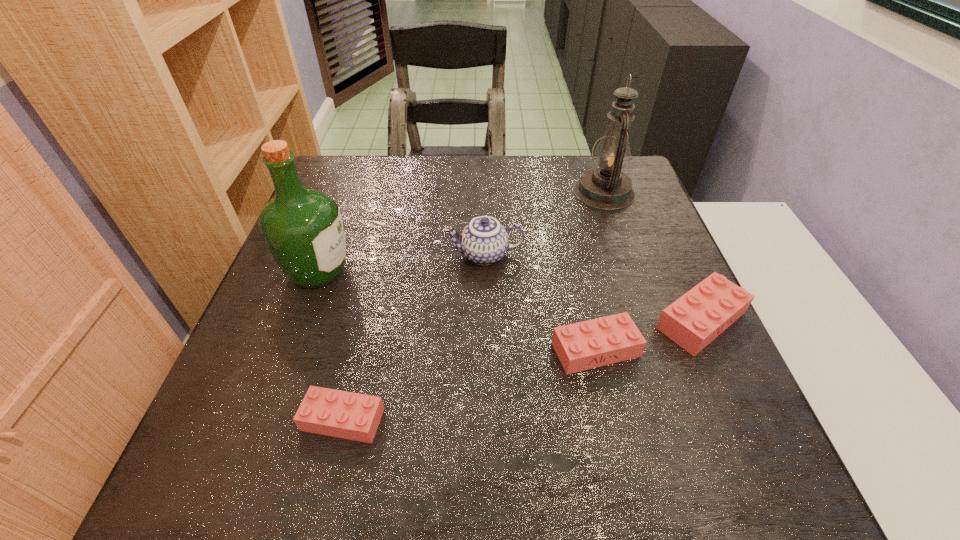
To achieve even spacing by inserting another Lego among them, please point to a vacant spot for this new Lego. Please provide its 2D coordinates. Your answer should be formatted as a tuple, i.e. [(x, y)], where the tuple contains the x and y coordinates of a point satisfying the conditions above.

[(477, 382)]